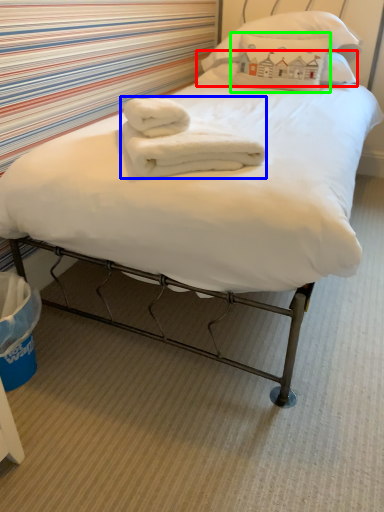
Question: Estimate the real-world distances between objects in this image. Which object is farther from pillow (highlighted by a red box), bath towel (highlighted by a blue box) or pillow (highlighted by a green box)?

Choices:
 (A) bath towel
 (B) pillow

Answer: (A)